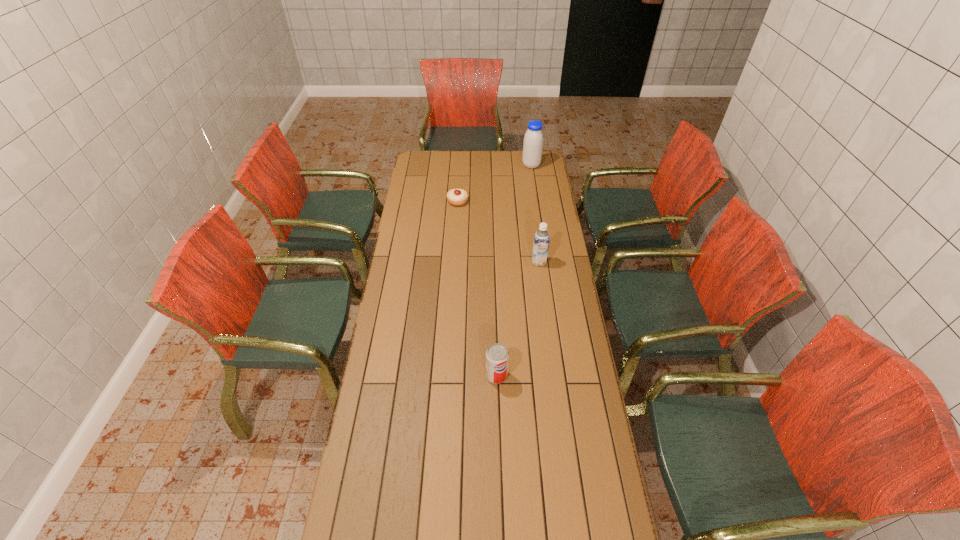
This screenshot has height=540, width=960. I want to click on the tallest object, so click(x=533, y=140).

Locate an element on the screen. the farthest object is located at coordinates (533, 140).

At what (x,y) coordinates should I click in order to perform the action: click on the second tallest object. Please return your answer as a coordinate pair (x, y). This screenshot has width=960, height=540. Looking at the image, I should click on (541, 241).

Where is `the second nearest object`? This screenshot has width=960, height=540. the second nearest object is located at coordinates (541, 241).

Where is `soda`? This screenshot has width=960, height=540. soda is located at coordinates (497, 356).

Locate an element on the screen. This screenshot has width=960, height=540. the third tallest object is located at coordinates (497, 356).

The width and height of the screenshot is (960, 540). I want to click on the leftmost object, so click(x=457, y=197).

Find the location of a particular element. The image size is (960, 540). pastry is located at coordinates (457, 197).

Image resolution: width=960 pixels, height=540 pixels. Identify the location of free space located on the left of the taller soya milk. (512, 165).

This screenshot has height=540, width=960. What are the coordinates of `blank space located on the label of the nearer soya milk` in the screenshot? It's located at (541, 280).